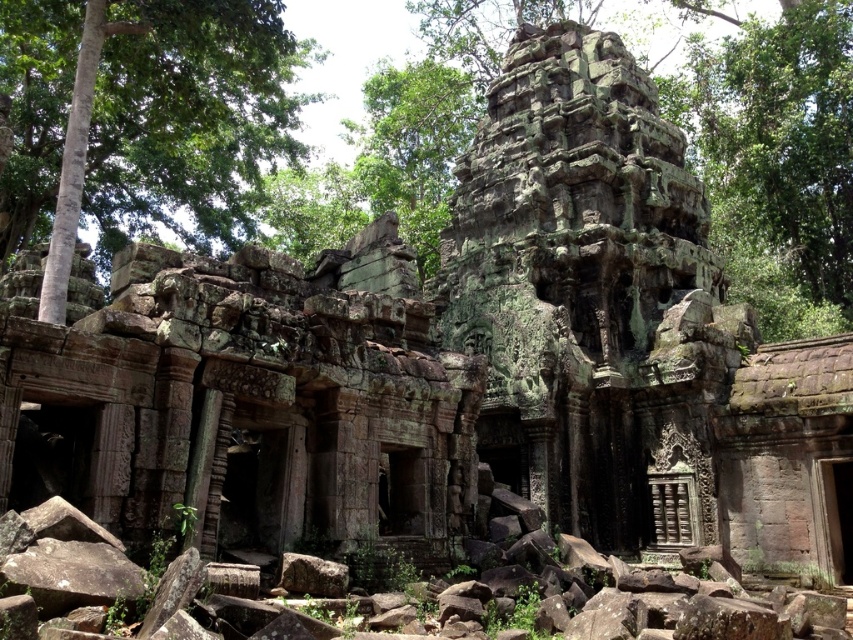
Is point (775, 172) more distant than point (822, 269)?

No, (775, 172) is in front of (822, 269).

Which is behind, point (763, 64) or point (791, 180)?

Positioned behind is point (763, 64).

Locate an element on the screen. This screenshot has width=853, height=640. green mossy stone temple at center is located at coordinates 776,161.

Is point (276, 52) farther from camera compared to point (427, 237)?

That is False.

Who is positioned more to the left, green mossy tree at upper left or green mossy stone temple at center?

From the viewer's perspective, green mossy tree at upper left appears more on the left side.

What do you see at coordinates (144, 113) in the screenshot? This screenshot has width=853, height=640. I see `green mossy tree at upper left` at bounding box center [144, 113].

Locate an element on the screen. The width and height of the screenshot is (853, 640). green mossy tree at upper left is located at coordinates (144, 113).

Does green mossy tree at upper left have a larger size compared to green mossy rock at upper center?

Indeed, green mossy tree at upper left has a larger size compared to green mossy rock at upper center.

Based on the photo, who is taller, green mossy tree at upper left or green mossy rock at upper center?

Standing taller between the two is green mossy rock at upper center.

This screenshot has width=853, height=640. What do you see at coordinates (144, 113) in the screenshot?
I see `green mossy tree at upper left` at bounding box center [144, 113].

You are a GUI agent. You are given a task and a screenshot of the screen. Output one action in this format:
    pyautogui.click(x=<x>, y=<y>)
    Task: Click on the green mossy tree at upper left
    Image resolution: width=853 pixels, height=640 pixels.
    Given the screenshot: What is the action you would take?
    pyautogui.click(x=144, y=113)